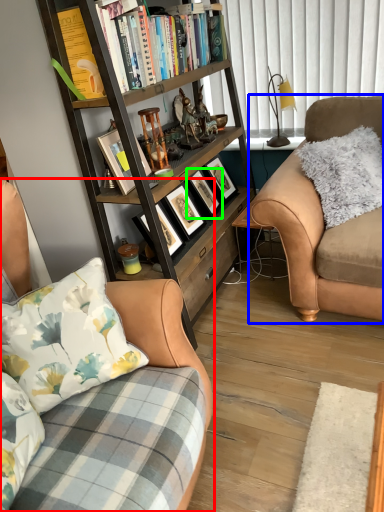
Question: Which is farther away from studio couch (highlighted by a red box)? studio couch (highlighted by a blue box) or picture frame (highlighted by a green box)?

Choices:
 (A) studio couch
 (B) picture frame

Answer: (B)